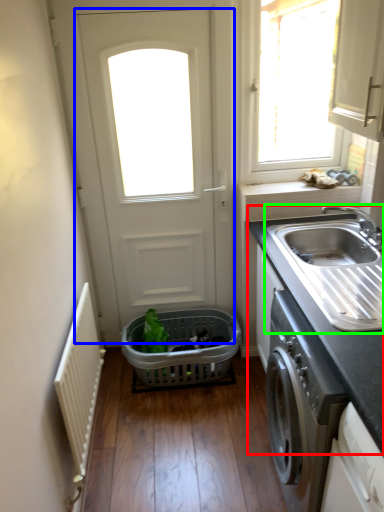
Question: Based on their relative distances, which object is nearer to countertop (highlighted by a red box)? Choose from door (highlighted by a blue box) and sink (highlighted by a green box).

Choices:
 (A) door
 (B) sink

Answer: (B)